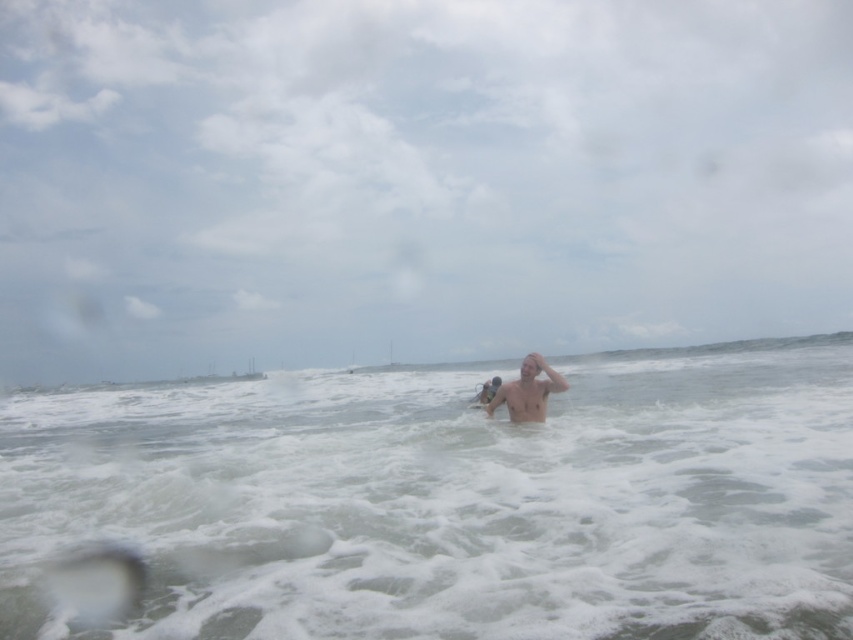
Consider the image. You are a lifeguard on duty and notice a swimmer in the water. You see the white foamy water at center and the shiny skin head at center. Based on their distance, can you estimate if the swimmer is in immediate danger from the waves?

The white foamy water at center is 22.97 feet away from the shiny skin head at center. Since the distance is relatively large, the swimmer is likely not in immediate danger from the waves.

You are a photographer trying to capture the shiny skin head at center and the white foamy water at center. Which object is positioned closer to your camera lens?

The white foamy water at center is closer to the viewer than the shiny skin head at center, so it will appear closer to the camera lens.